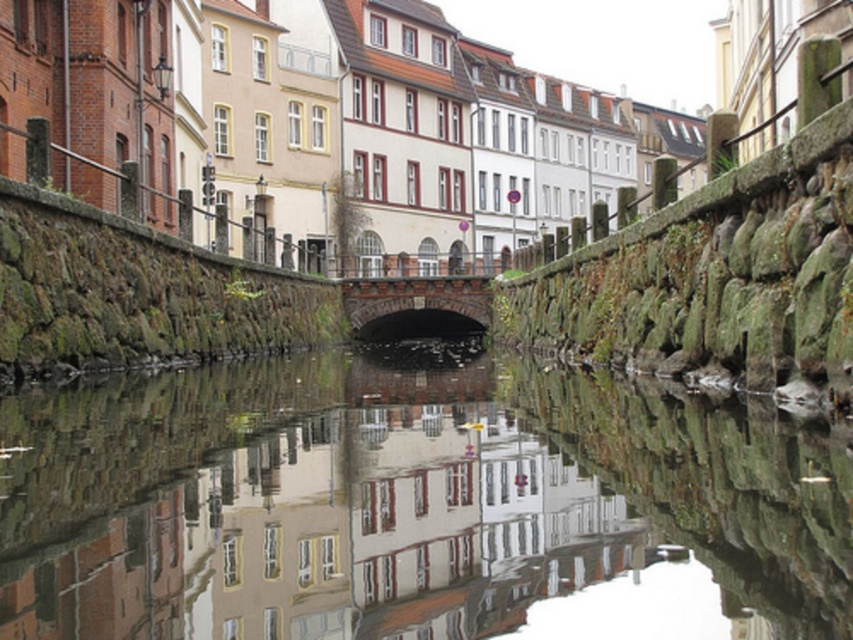
You are standing at the edge of the canal and want to take a photo that includes both point (381,550) and point (368,336). Since you need to ensure both points are in focus, which point should you focus on to maximize the depth of field?

You should focus on point (368,336) because it is farther from the viewer than point (381,550). Focusing on the farther point will ensure both points are within the depth of field.

You are a tour guide explaining the canal layout to visitors. You mention the smooth reflective water at center and the dark brown stone bridge at center. Which of these two features is wider?

The smooth reflective water at center is wider than the dark brown stone bridge at center according to the description.

You are standing on the dark brown stone bridge at center and want to see your reflection in the smooth reflective water at center. In which direction should you look to see your reflection?

You should look to the left because the smooth reflective water at center is to the left of the dark brown stone bridge at center.